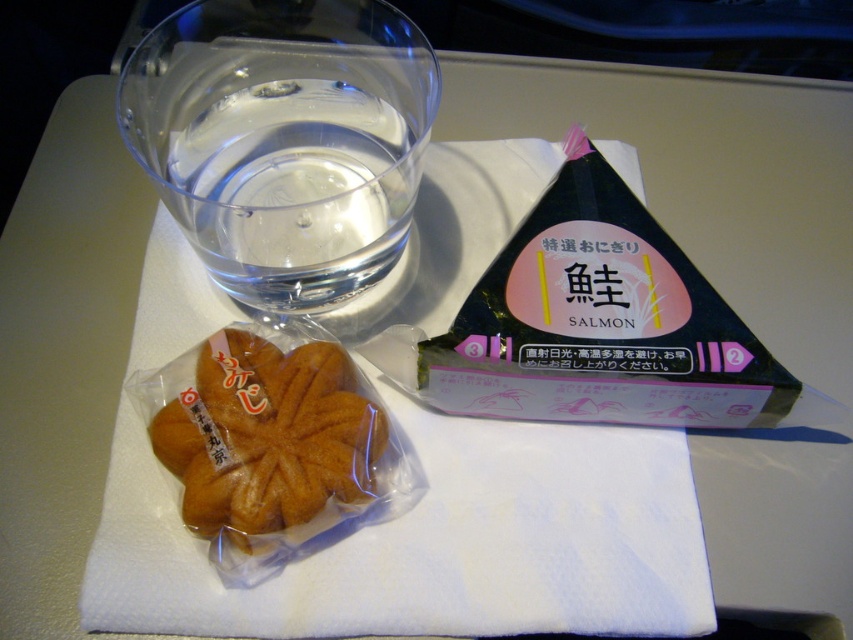
Question: Can you confirm if black paper triangle at upper right is smaller than golden brown pastry at center?

Choices:
 (A) no
 (B) yes

Answer: (A)

Question: Which point is closer to the camera?

Choices:
 (A) (582, 163)
 (B) (198, 515)

Answer: (B)

Question: Considering the relative positions of black paper triangle at upper right and golden brown pastry at center in the image provided, where is black paper triangle at upper right located with respect to golden brown pastry at center?

Choices:
 (A) right
 (B) left

Answer: (A)

Question: Which point appears closest to the camera in this image?

Choices:
 (A) (596, 320)
 (B) (216, 332)

Answer: (A)

Question: Is black paper triangle at upper right bigger than golden brown pastry at center?

Choices:
 (A) no
 (B) yes

Answer: (B)

Question: Which of the following is the closest to the observer?

Choices:
 (A) (299, 512)
 (B) (624, 360)

Answer: (A)